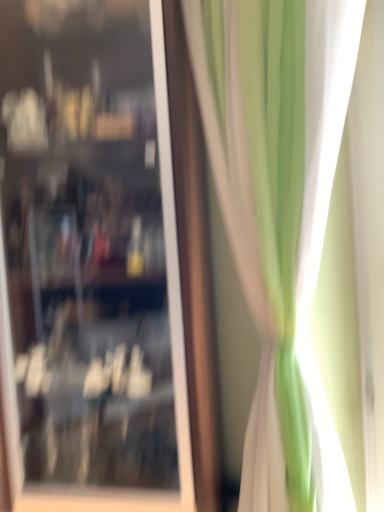
Question: Can you confirm if green fabric curtain at right is thinner than transparent glass cabinet at center?

Choices:
 (A) no
 (B) yes

Answer: (B)

Question: Does green fabric curtain at right have a greater width compared to transparent glass cabinet at center?

Choices:
 (A) yes
 (B) no

Answer: (B)

Question: From the image's perspective, is green fabric curtain at right over transparent glass cabinet at center?

Choices:
 (A) yes
 (B) no

Answer: (B)

Question: Considering the relative sizes of green fabric curtain at right and transparent glass cabinet at center in the image provided, is green fabric curtain at right smaller than transparent glass cabinet at center?

Choices:
 (A) no
 (B) yes

Answer: (B)

Question: Is transparent glass cabinet at center a part of green fabric curtain at right?

Choices:
 (A) no
 (B) yes

Answer: (A)

Question: Considering the relative positions of green fabric curtain at right and transparent glass cabinet at center in the image provided, is green fabric curtain at right in front of transparent glass cabinet at center?

Choices:
 (A) no
 (B) yes

Answer: (B)

Question: Would you say transparent glass cabinet at center contains green fabric curtain at right?

Choices:
 (A) no
 (B) yes

Answer: (A)

Question: From a real-world perspective, is transparent glass cabinet at center physically below green fabric curtain at right?

Choices:
 (A) no
 (B) yes

Answer: (A)

Question: Considering the relative sizes of transparent glass cabinet at center and green fabric curtain at right in the image provided, is transparent glass cabinet at center taller than green fabric curtain at right?

Choices:
 (A) no
 (B) yes

Answer: (B)

Question: Is transparent glass cabinet at center beside green fabric curtain at right?

Choices:
 (A) yes
 (B) no

Answer: (B)

Question: Can you confirm if transparent glass cabinet at center is positioned to the right of green fabric curtain at right?

Choices:
 (A) yes
 (B) no

Answer: (B)

Question: From a real-world perspective, does transparent glass cabinet at center stand above green fabric curtain at right?

Choices:
 (A) yes
 (B) no

Answer: (A)

Question: Is transparent glass cabinet at center situated inside green fabric curtain at right or outside?

Choices:
 (A) inside
 (B) outside

Answer: (B)